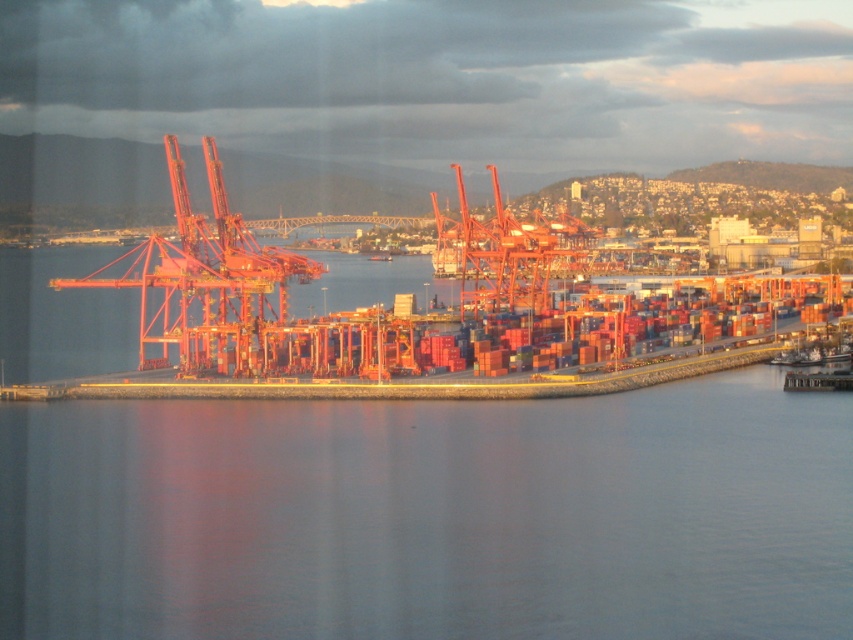
Question: Does transparent water at lower center appear over metallic orange crane at center?

Choices:
 (A) no
 (B) yes

Answer: (A)

Question: Which of the following is the farthest from the observer?

Choices:
 (A) transparent water at lower center
 (B) metallic orange crane at center

Answer: (B)

Question: Which point appears closest to the camera in this image?

Choices:
 (A) tap(816, 628)
 (B) tap(480, 275)

Answer: (A)

Question: Can you confirm if transparent water at lower center is positioned to the right of metallic orange crane at center?

Choices:
 (A) no
 (B) yes

Answer: (A)

Question: Does transparent water at lower center have a larger size compared to metallic orange crane at center?

Choices:
 (A) yes
 (B) no

Answer: (A)